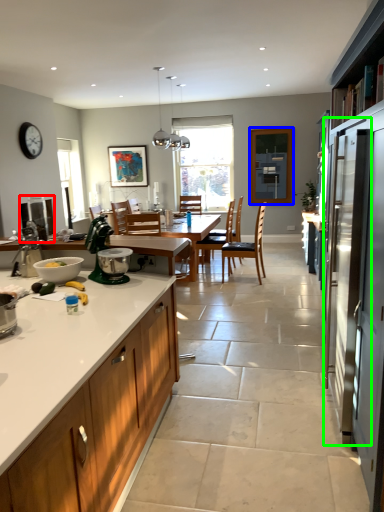
Question: Which object is positioned farthest from appliance (highlighted by a red box)? Select from window screen (highlighted by a blue box) and screen door (highlighted by a green box).

Choices:
 (A) window screen
 (B) screen door

Answer: (A)